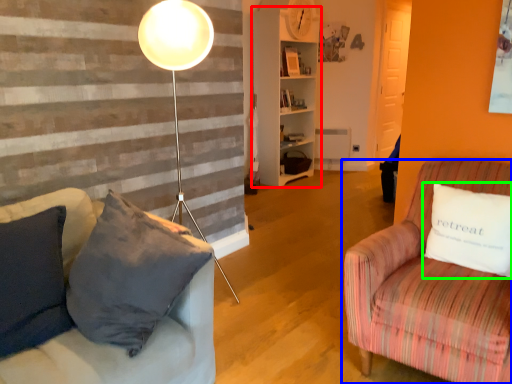
Question: Based on their relative distances, which object is nearer to shelf (highlighted by a red box)? Choose from studio couch (highlighted by a blue box) and pillow (highlighted by a green box).

Choices:
 (A) studio couch
 (B) pillow

Answer: (A)